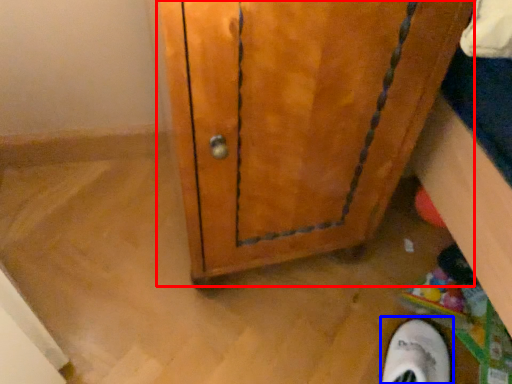
Question: Which point is further to the camera, door (highlighted by a red box) or footwear (highlighted by a blue box)?

Choices:
 (A) door
 (B) footwear

Answer: (B)